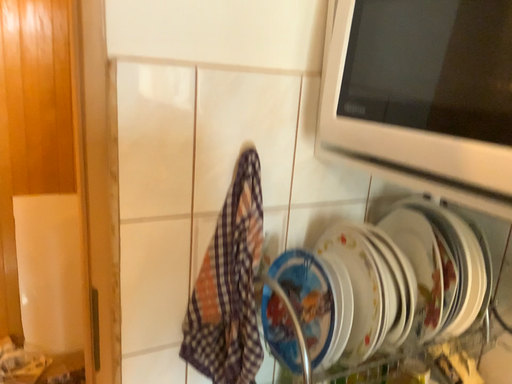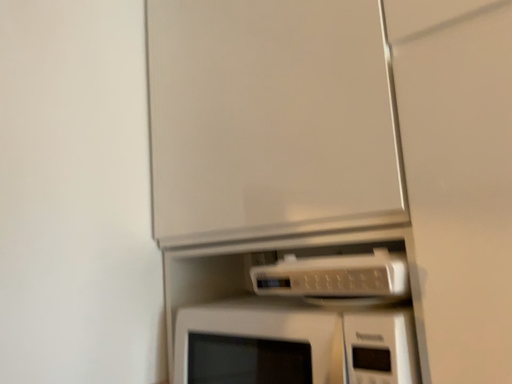
Question: Which way did the camera rotate in the video?

Choices:
 (A) rotated upward
 (B) rotated downward

Answer: (A)